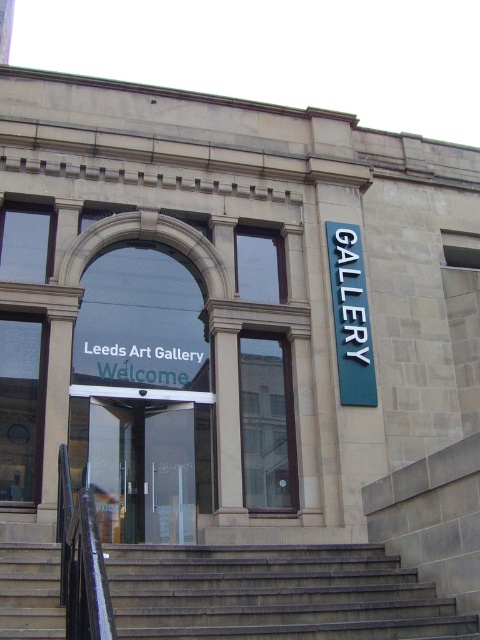
You are a delivery person with a large box that is 2 meters wide. You need to bring the box up the steps to the entrance. Can you fit the box on the gray concrete stairs at center without it overlapping the blue metallic sign at upper right?

The gray concrete stairs at center might be wider than blue metallic sign at upper right, so there is a possibility that the stairs are wide enough to accommodate the 2m wide box without overlapping the sign. However, since the exact width isn

You are at the entrance of Leeds Art Gallery and want to enter through the transparent glass door at center. Which direction should you move relative to the gray concrete stairs at center to reach it?

Since the gray concrete stairs at center are positioned under the transparent glass door at center, you should move upward from the gray concrete stairs at center to reach the transparent glass door at center.